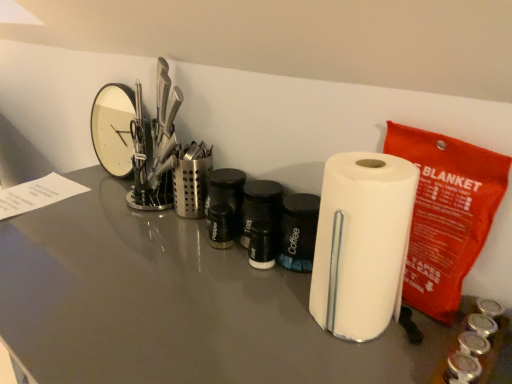
The image size is (512, 384). I want to click on free space that is to the left of satin silver utensil holder at center, which is the second stationery in right-to-left order, so click(x=133, y=208).